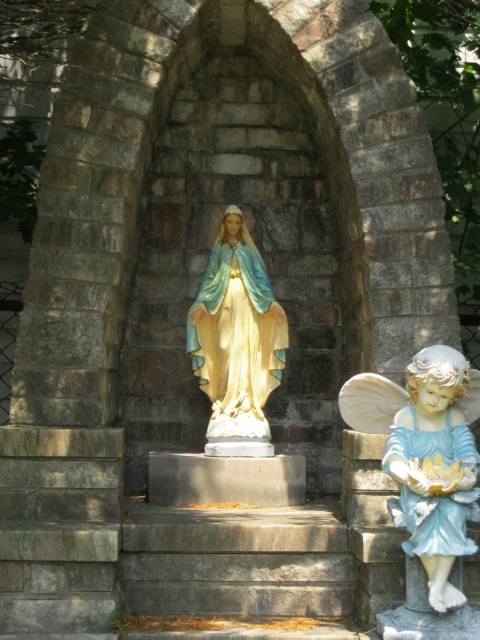
Question: Does porcelain angel at right appear on the left side of matte gold statue at center?

Choices:
 (A) yes
 (B) no

Answer: (B)

Question: From the image, what is the correct spatial relationship of porcelain angel at right in relation to matte gold statue at center?

Choices:
 (A) above
 (B) below

Answer: (B)

Question: Is porcelain angel at right positioned at the back of matte gold statue at center?

Choices:
 (A) no
 (B) yes

Answer: (A)

Question: Which point is farther to the camera?

Choices:
 (A) matte gold statue at center
 (B) porcelain angel at right

Answer: (A)

Question: Which of the following is the closest to the observer?

Choices:
 (A) porcelain angel at right
 (B) matte gold statue at center

Answer: (A)